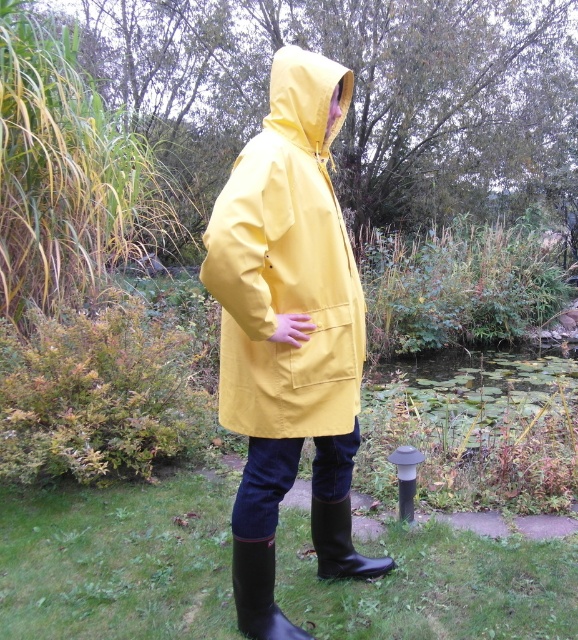
You are designing a storage box to fit both the yellow matte raincoat at center and the black rubber boot at lower center. Given their sizes, which item will require more space in the storage box?

The yellow matte raincoat at center requires more space in the storage box because its width is larger than the black rubber boot at lower center.

You are a fashion designer observing the yellow matte raincoat at center and the black rubber boot at lower center in the image. Which item would require more fabric to create?

The yellow matte raincoat at center requires more fabric than the black rubber boot at lower center because it is larger in size.